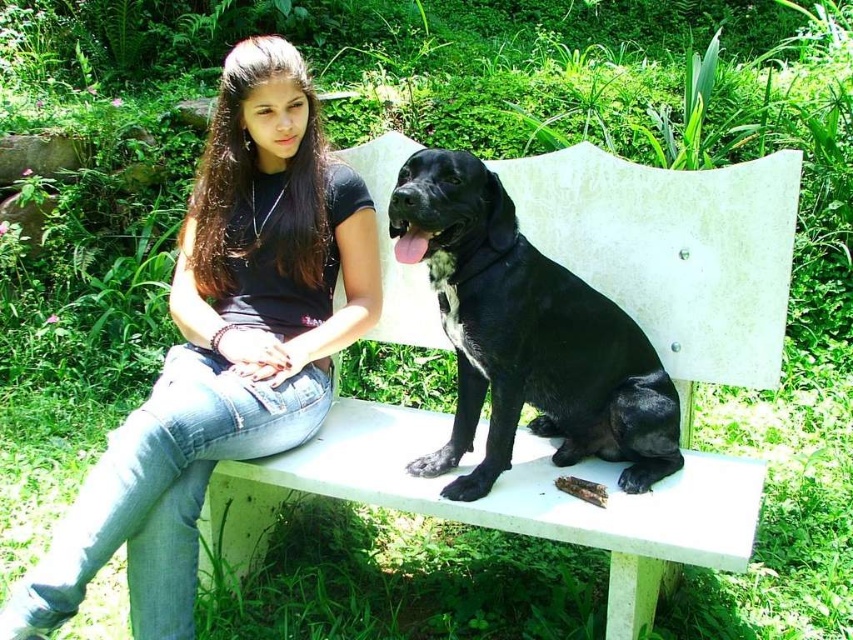
You are a photographer standing in front of the scene. You want to take a photo of the black matte shirt at upper center and the black smooth dog at center. Which object is closer to your camera lens?

The black matte shirt at upper center is closer to the camera lens because it is further to the viewer than the black smooth dog at center.

You are planning to place a small potted plant between the white matte park bench at center and the black smooth dog at center. Considering their sizes, which object should the plant be closer to to ensure it fits comfortably?

The white matte park bench at center is wider than the black smooth dog at center. Therefore, the plant should be placed closer to the black smooth dog at center to ensure it fits comfortably between them.